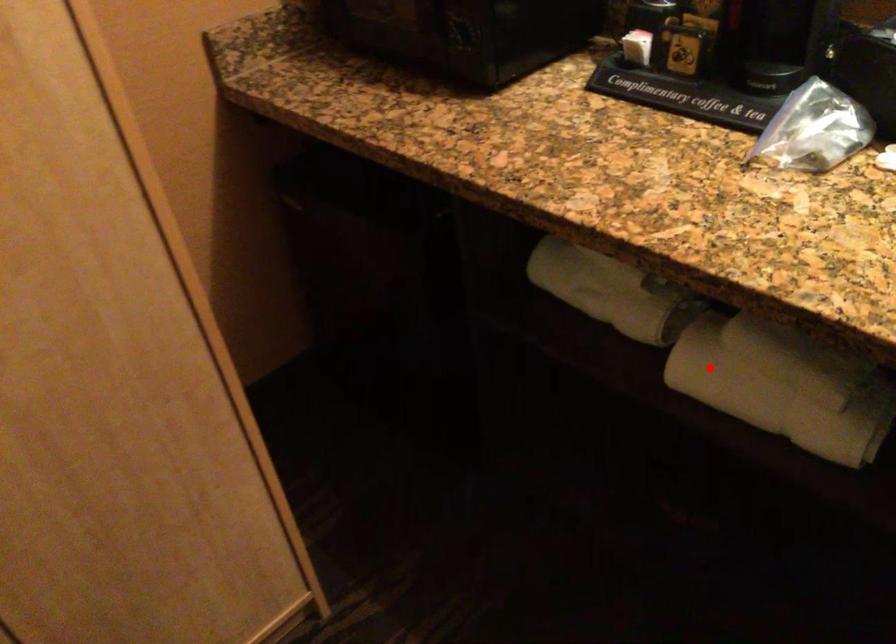
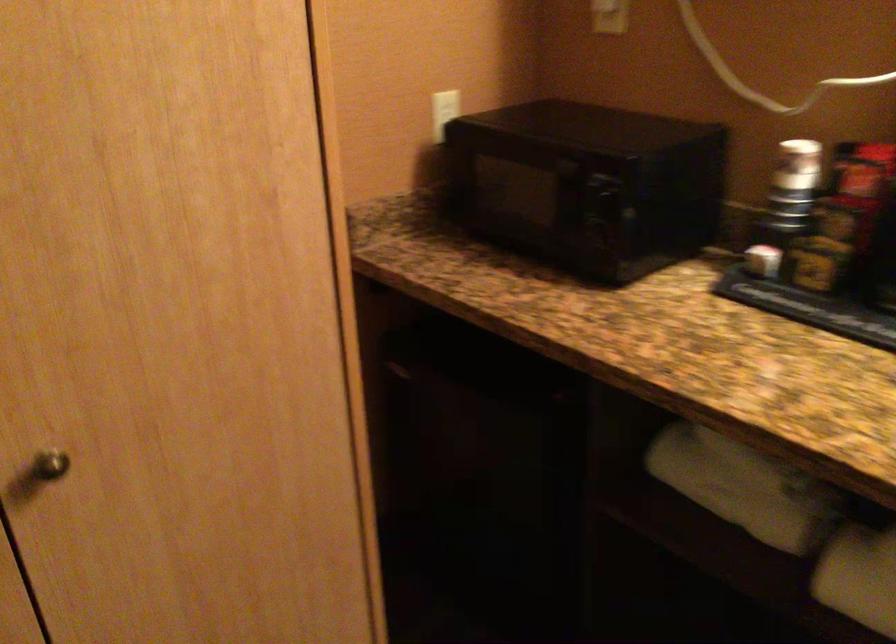
Where in the second image is the point corresponding to the highlighted location from the first image?

(858, 576)